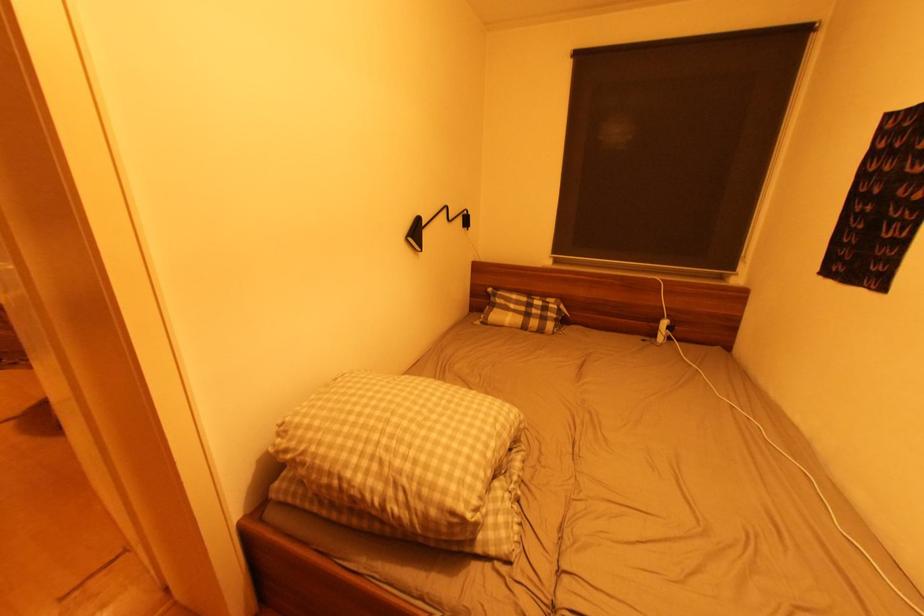
Where is `checkered pillow`? checkered pillow is located at coordinates (523, 312).